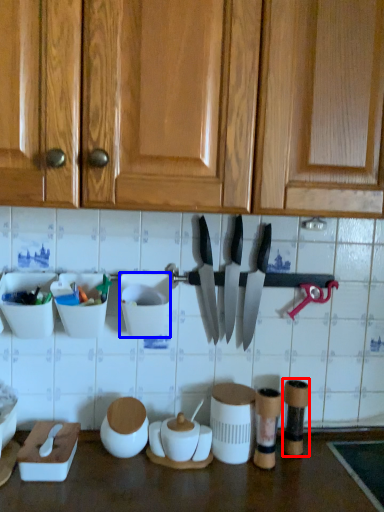
Question: Which object is further to the camera taking this photo, tableware (highlighted by a red box) or tableware (highlighted by a blue box)?

Choices:
 (A) tableware
 (B) tableware

Answer: (A)